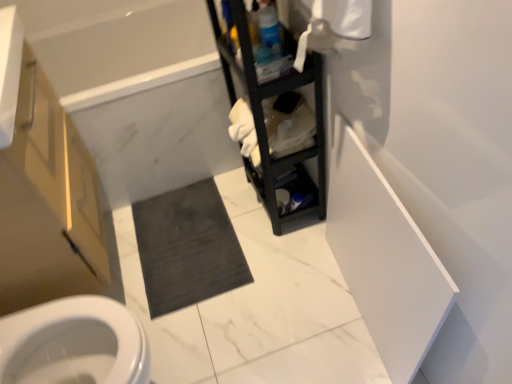
Where is `vacant area on top of dark gray carpet at center (from a real-world perspective)`? This screenshot has width=512, height=384. vacant area on top of dark gray carpet at center (from a real-world perspective) is located at coordinates (179, 227).